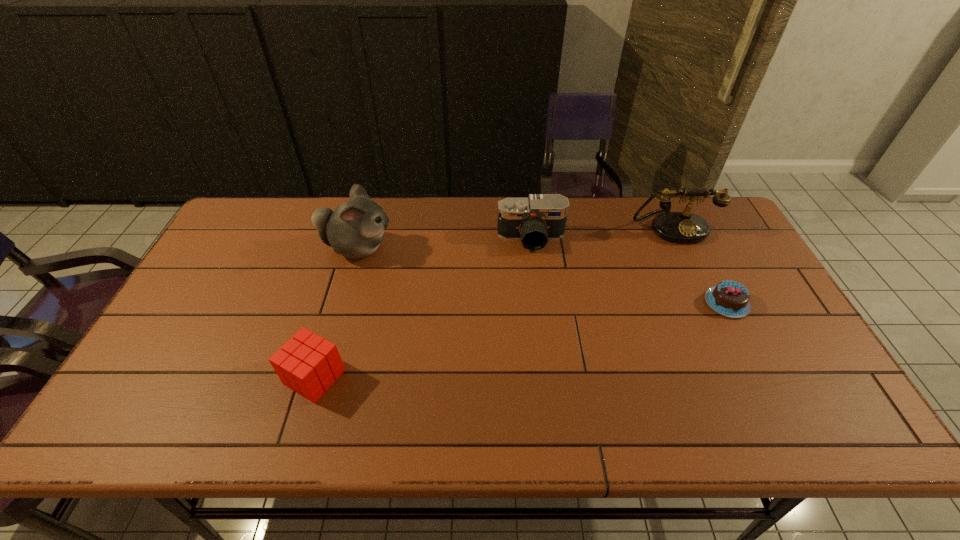
Where is `hamster`? hamster is located at coordinates (354, 229).

The width and height of the screenshot is (960, 540). I want to click on telephone, so click(678, 227).

Where is `camera`? Image resolution: width=960 pixels, height=540 pixels. camera is located at coordinates [x=534, y=220].

Where is `the third tallest object`? This screenshot has width=960, height=540. the third tallest object is located at coordinates (534, 220).

The image size is (960, 540). I want to click on cube, so click(308, 364).

The height and width of the screenshot is (540, 960). Identify the location of the nearest object. (308, 364).

Where is `the second nearest object`? The image size is (960, 540). the second nearest object is located at coordinates (731, 299).

Locate an element on the screen. This screenshot has height=540, width=960. the shortest object is located at coordinates (731, 299).

The width and height of the screenshot is (960, 540). Identify the location of vacant space situated on the face of the hamster. (464, 248).

Find the location of a particular element. The image size is (960, 540). vacant space located on the dial of the fourth shortest object is located at coordinates click(699, 284).